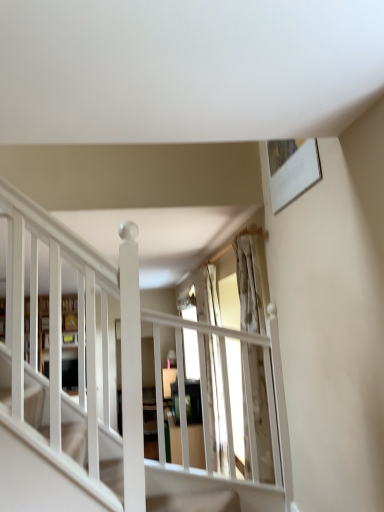
Question: Is white wooden shelf at left oriented towards translucent glass window at center?

Choices:
 (A) yes
 (B) no

Answer: (A)

Question: From the image's perspective, does white wooden shelf at left appear higher than translucent glass window at center?

Choices:
 (A) no
 (B) yes

Answer: (A)

Question: Considering the relative sizes of white wooden shelf at left and translucent glass window at center in the image provided, is white wooden shelf at left wider than translucent glass window at center?

Choices:
 (A) yes
 (B) no

Answer: (B)

Question: Can you confirm if white wooden shelf at left is positioned to the right of translucent glass window at center?

Choices:
 (A) no
 (B) yes

Answer: (A)

Question: Considering the relative sizes of white wooden shelf at left and translucent glass window at center in the image provided, is white wooden shelf at left bigger than translucent glass window at center?

Choices:
 (A) yes
 (B) no

Answer: (B)

Question: Is point (69, 295) closer or farther from the camera than point (253, 352)?

Choices:
 (A) farther
 (B) closer

Answer: (B)

Question: Looking at the image, does wooden bookshelf at left seem bigger or smaller compared to translucent glass window at center?

Choices:
 (A) small
 (B) big

Answer: (B)

Question: Is wooden bookshelf at left to the left or to the right of translucent glass window at center in the image?

Choices:
 (A) right
 (B) left

Answer: (B)

Question: From a real-world perspective, is wooden bookshelf at left positioned above or below translucent glass window at center?

Choices:
 (A) above
 (B) below

Answer: (A)

Question: Is wooden bookshelf at left to the left or to the right of white wooden shelf at left in the image?

Choices:
 (A) left
 (B) right

Answer: (A)

Question: In terms of width, does wooden bookshelf at left look wider or thinner when compared to white wooden shelf at left?

Choices:
 (A) thin
 (B) wide

Answer: (B)

Question: Is wooden bookshelf at left taller or shorter than white wooden shelf at left?

Choices:
 (A) tall
 (B) short

Answer: (A)

Question: Which is correct: wooden bookshelf at left is inside white wooden shelf at left, or outside of it?

Choices:
 (A) outside
 (B) inside

Answer: (A)

Question: Considering the positions of translucent glass window at center and wooden bookshelf at left in the image, is translucent glass window at center wider or thinner than wooden bookshelf at left?

Choices:
 (A) thin
 (B) wide

Answer: (A)

Question: Is point (205, 278) closer or farther from the camera than point (72, 327)?

Choices:
 (A) farther
 (B) closer

Answer: (A)